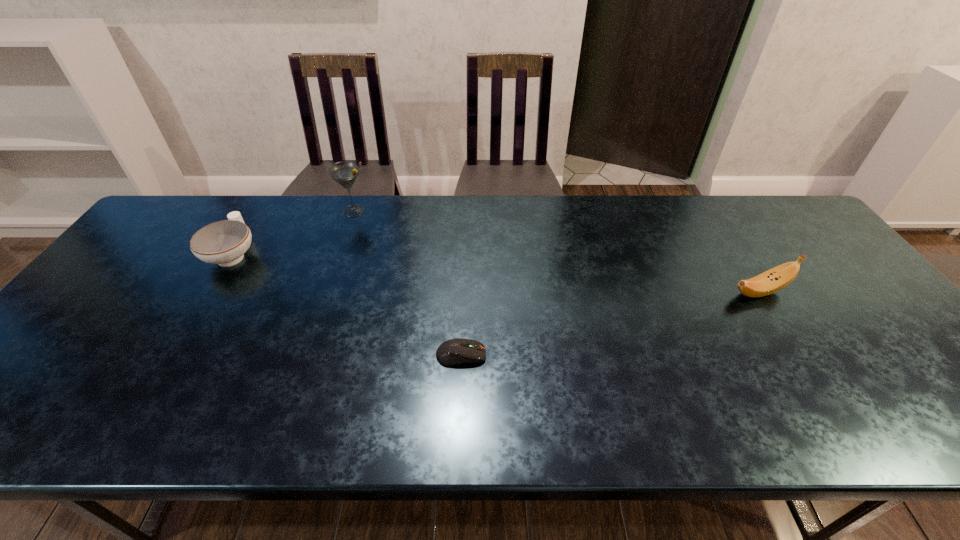
Locate an element on the screen. free space between the shortest object and the third farthest object is located at coordinates (611, 323).

Where is `blank region between the second object from right to left and the tallest object`? The image size is (960, 540). blank region between the second object from right to left and the tallest object is located at coordinates (407, 283).

You are a GUI agent. You are given a task and a screenshot of the screen. Output one action in this format:
    pyautogui.click(x=<x>, y=<y>)
    Task: Click on the free point between the martini and the third tallest object
    This screenshot has height=540, width=960.
    Given the screenshot: What is the action you would take?
    tap(294, 232)

Find the location of `free spot between the second shortest object and the rightmost object`. free spot between the second shortest object and the rightmost object is located at coordinates (496, 273).

What are the coordinates of `free space that is in between the third object from left to right and the chinaware` in the screenshot? It's located at (348, 305).

Locate an element on the screen. Image resolution: width=960 pixels, height=540 pixels. free space between the computer equipment and the rightmost object is located at coordinates (611, 323).

The height and width of the screenshot is (540, 960). In order to click on vacant area between the third farthest object and the chinaware in this screenshot , I will do `click(496, 273)`.

Locate an element on the screen. The width and height of the screenshot is (960, 540). free space between the leftmost object and the rightmost object is located at coordinates (496, 273).

At what (x,y) coordinates should I click in order to perform the action: click on unoccupied area between the banana and the martini. Please return your answer as a coordinate pair (x, y). This screenshot has height=540, width=960. Looking at the image, I should click on (557, 251).

Find the location of a particular element. This screenshot has width=960, height=540. object that is the second nearest to the third object from left to right is located at coordinates (224, 242).